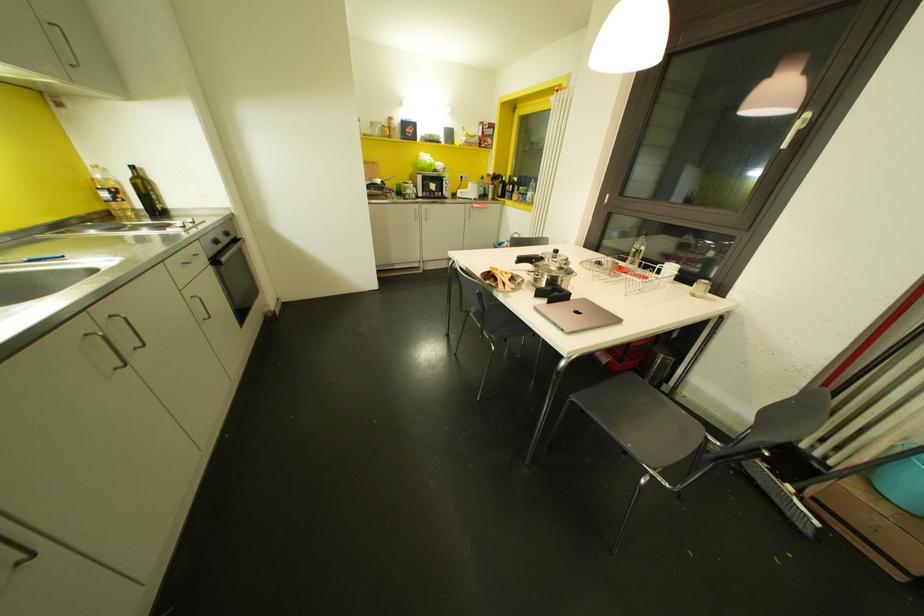
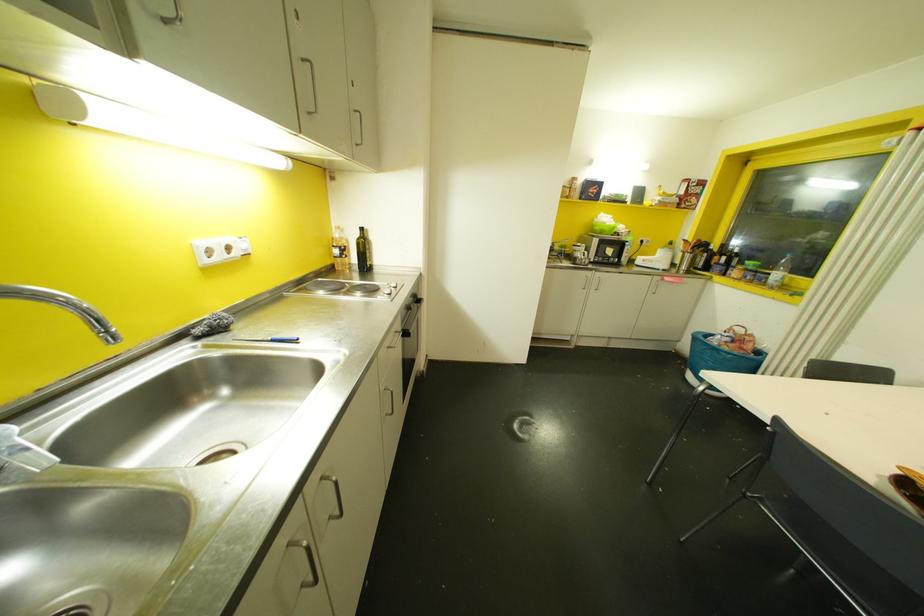
Where in the second image is the point corresponding to [104,195] from the first image?

(335, 251)